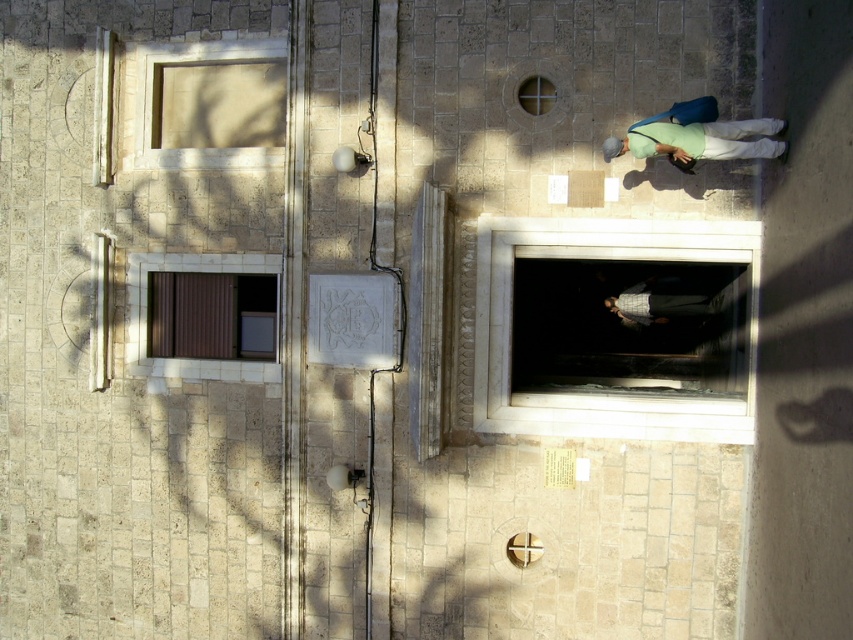
You are an architect analyzing the building facade. You need to determine which window is taller between the white marble window at center and the brown matte window at upper left. Based on the scene, which one is taller?

The white marble window at center is taller than the brown matte window at upper left according to the description.

You are an architect examining the building facade. You need to install a new light fixture between the white marble window at center and the brown matte window at upper left. Based on their positions, where should the light fixture be placed?

The white marble window at center is located below the brown matte window at upper left, so the light fixture should be placed between them, above the white marble window at center and below the brown matte window at upper left.

You are standing in front of a historical building and want to take a photo of the point at coordinates point (776, 154). If your camera can focus on objects up to 10 meters away, will you be able to capture the point clearly?

The distance of point (776, 154) from camera is 11.76 meters, which is beyond the camera focus range of 10 meters. Therefore, the point cannot be captured clearly.